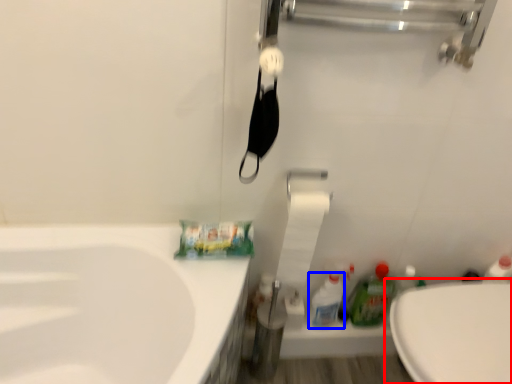
Question: Which of the following is the closest to the observer, toilet (highlighted by a red box) or cleaning product (highlighted by a blue box)?

Choices:
 (A) toilet
 (B) cleaning product

Answer: (A)